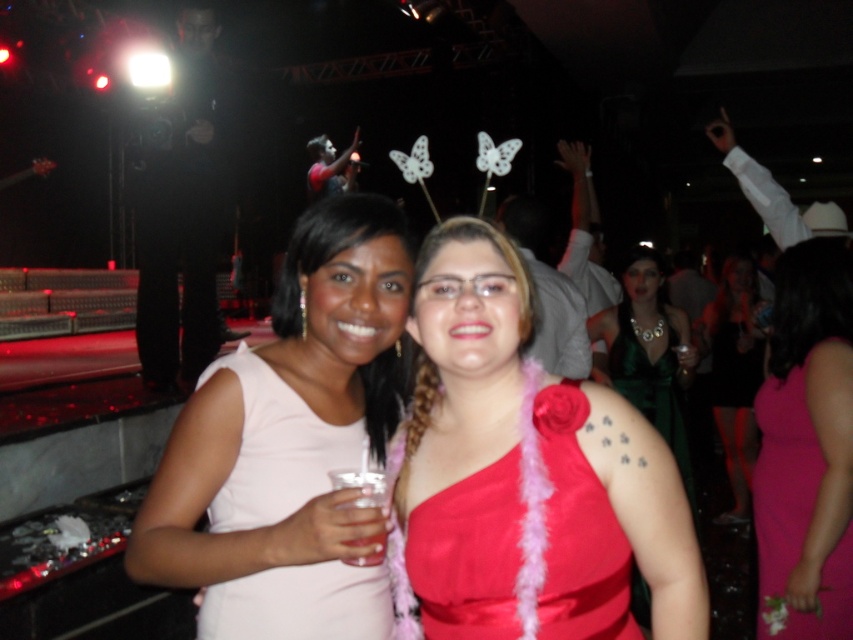
Can you confirm if matte white dress at center is bigger than matte green dress at center?

Incorrect, matte white dress at center is not larger than matte green dress at center.

Is matte white dress at center closer to camera compared to matte green dress at center?

Yes, matte white dress at center is in front of matte green dress at center.

Is point (337, 380) less distant than point (712, 381)?

Yes, point (337, 380) is closer to viewer.

The height and width of the screenshot is (640, 853). In order to click on matte white dress at center in this screenshot , I will do `click(288, 444)`.

Can you confirm if satin red dress at center is smaller than green satin dress at center?

Indeed, satin red dress at center has a smaller size compared to green satin dress at center.

Between satin red dress at center and green satin dress at center, which one is positioned higher?

green satin dress at center is above.

Is point (573, 490) farther from viewer compared to point (648, 276)?

No.

This screenshot has height=640, width=853. I want to click on satin red dress at center, so click(518, 541).

Who is positioned more to the right, satin red dress at center or matte green dress at center?

matte green dress at center is more to the right.

Can you confirm if satin red dress at center is bigger than matte green dress at center?

Actually, satin red dress at center might be smaller than matte green dress at center.

Image resolution: width=853 pixels, height=640 pixels. What are the coordinates of `satin red dress at center` in the screenshot? It's located at tap(518, 541).

The height and width of the screenshot is (640, 853). I want to click on satin red dress at center, so click(518, 541).